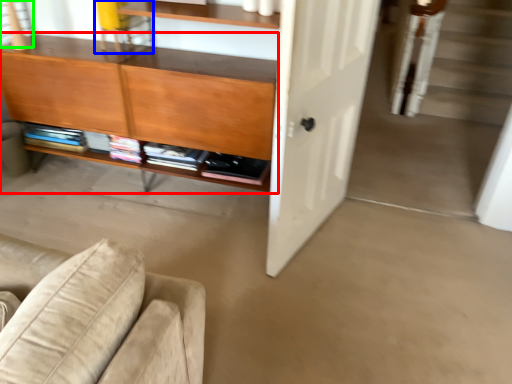
Question: Estimate the real-world distances between objects in this image. Which object is closer to cabinetry (highlighted by a red box), chair (highlighted by a blue box) or window (highlighted by a green box)?

Choices:
 (A) chair
 (B) window

Answer: (A)